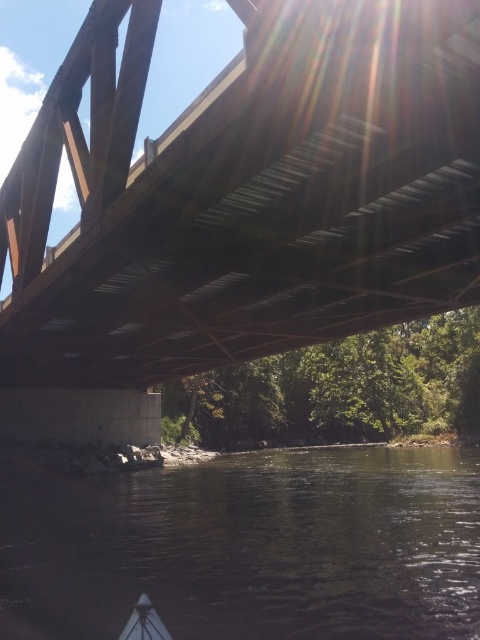
Question: Is dark water at lower center below white plastic boat at lower center?

Choices:
 (A) yes
 (B) no

Answer: (A)

Question: Which of the following is the farthest from the observer?

Choices:
 (A) dark water at lower center
 (B) metallic brown bridge at upper center
 (C) white plastic boat at lower center

Answer: (A)

Question: Considering the real-world distances, which object is closest to the white plastic boat at lower center?

Choices:
 (A) metallic brown bridge at upper center
 (B) dark water at lower center

Answer: (B)

Question: Can you confirm if dark water at lower center is smaller than white plastic boat at lower center?

Choices:
 (A) yes
 (B) no

Answer: (B)

Question: Which point is closer to the camera taking this photo?

Choices:
 (A) (131, 634)
 (B) (389, 538)
 (C) (248, 188)

Answer: (A)

Question: Is dark water at lower center thinner than white plastic boat at lower center?

Choices:
 (A) no
 (B) yes

Answer: (A)